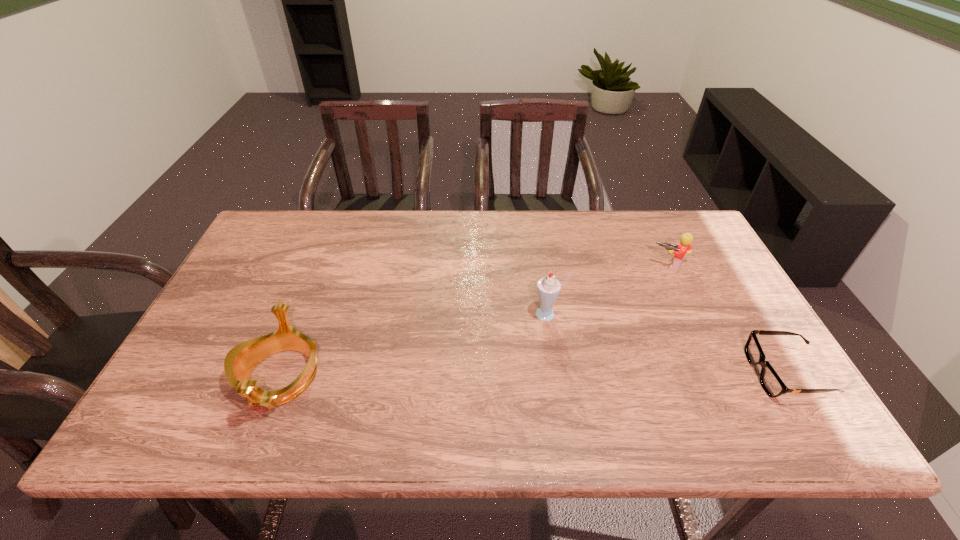
Find the location of `Lego positioned at the right edge`. Lego positioned at the right edge is located at coordinates (685, 245).

At what (x,y) coordinates should I click in order to perform the action: click on object that is positioned at the near left corner. Please return your answer as a coordinate pair (x, y). The height and width of the screenshot is (540, 960). Looking at the image, I should click on (241, 360).

In order to click on object that is at the near right corner in this screenshot , I will do `click(770, 381)`.

In the image, there is a desktop. Find the location of `vacant space at the far edge`. vacant space at the far edge is located at coordinates (536, 218).

The image size is (960, 540). Identify the location of free location at the near edge of the desktop. (570, 384).

In the image, there is a desktop. In order to click on free space at the left edge in this screenshot , I will do pyautogui.click(x=277, y=301).

In the image, there is a desktop. Where is `blank space at the far left corner`? The image size is (960, 540). blank space at the far left corner is located at coordinates (276, 220).

In the image, there is a desktop. Identify the location of vacant region at the near right corner. The width and height of the screenshot is (960, 540). (750, 372).

I want to click on free spot between the third object from left to right and the tiara, so click(x=474, y=322).

Locate an element on the screen. vacant space in between the rightmost object and the farthest object is located at coordinates (728, 320).